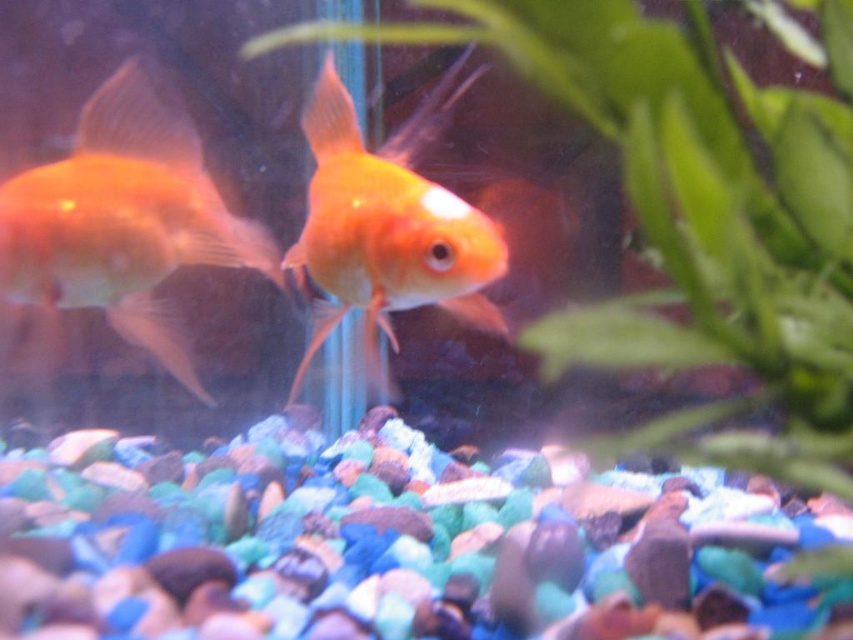
Question: Which point is farther to the camera?

Choices:
 (A) (807, 109)
 (B) (45, 301)
 (C) (453, 253)

Answer: (B)

Question: Which point appears closest to the camera in this image?

Choices:
 (A) (94, 170)
 (B) (659, 77)

Answer: (B)

Question: Observing the image, what is the correct spatial positioning of green leafy plant at center in reference to matte orange goldfish at left?

Choices:
 (A) above
 (B) below

Answer: (A)

Question: Observing the image, what is the correct spatial positioning of green leafy plant at center in reference to shiny orange fish at center?

Choices:
 (A) below
 (B) above

Answer: (B)

Question: Which object is positioned farthest from the shiny orange fish at center?

Choices:
 (A) matte orange goldfish at left
 (B) green leafy plant at center

Answer: (B)

Question: Can you confirm if green leafy plant at center is positioned to the left of shiny orange fish at center?

Choices:
 (A) yes
 (B) no

Answer: (B)